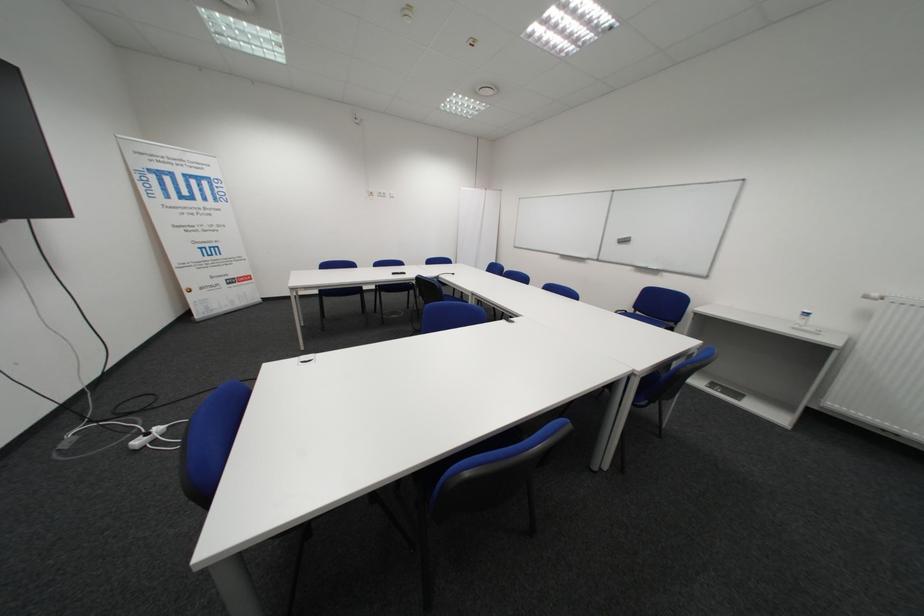
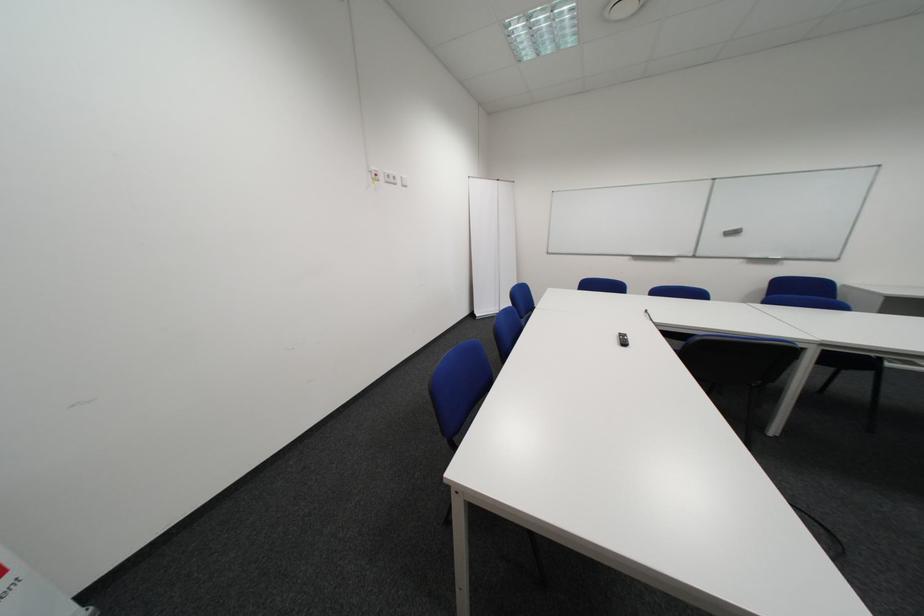
Locate, in the second image, the point that corresponds to the point at 391,196 in the first image.

(398, 180)